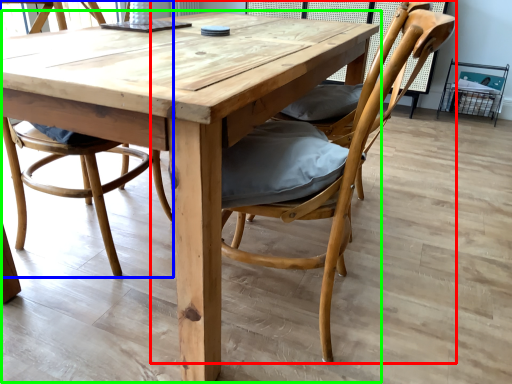
Question: Considering the real-world distances, which object is farthest from chair (highlighted by a red box)? chair (highlighted by a blue box) or kitchen & dining room table (highlighted by a green box)?

Choices:
 (A) chair
 (B) kitchen & dining room table

Answer: (A)